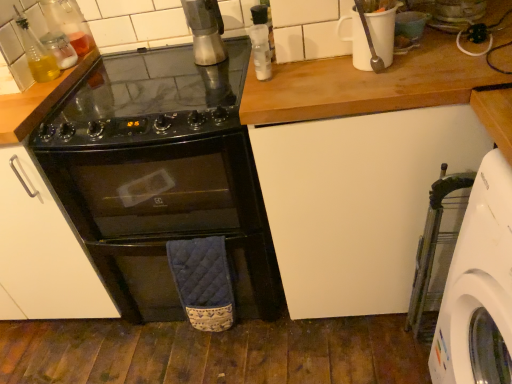
Question: Is translucent glass bottle at upper left, positioned as the 2th bottle in right-to-left order, directly adjacent to black glass gas stove at center?

Choices:
 (A) no
 (B) yes

Answer: (A)

Question: From a real-world perspective, is translucent glass bottle at upper left, positioned as the second bottle in left-to-right order, beneath black glass gas stove at center?

Choices:
 (A) yes
 (B) no

Answer: (B)

Question: Is translucent glass bottle at upper left, positioned as the 2th bottle in right-to-left order, outside black glass gas stove at center?

Choices:
 (A) no
 (B) yes

Answer: (B)

Question: Can black glass gas stove at center be found inside translucent glass bottle at upper left, positioned as the second bottle in left-to-right order?

Choices:
 (A) no
 (B) yes

Answer: (A)

Question: Is translucent glass bottle at upper left, positioned as the second bottle in left-to-right order, bigger than black glass gas stove at center?

Choices:
 (A) no
 (B) yes

Answer: (A)

Question: From the image's perspective, is black glass oven at center located above or below white plastic washing machine at lower right?

Choices:
 (A) above
 (B) below

Answer: (A)

Question: Would you say black glass oven at center is to the left or to the right of white plastic washing machine at lower right in the picture?

Choices:
 (A) left
 (B) right

Answer: (A)

Question: From their relative heights in the image, would you say black glass oven at center is taller or shorter than white plastic washing machine at lower right?

Choices:
 (A) short
 (B) tall

Answer: (B)

Question: Does point (87, 130) appear closer or farther from the camera than point (430, 233)?

Choices:
 (A) farther
 (B) closer

Answer: (B)

Question: Is white matte cabinet at center inside the boundaries of metallic silver grinder at upper center, or outside?

Choices:
 (A) inside
 (B) outside

Answer: (B)

Question: Is white matte cabinet at center to the left or to the right of metallic silver grinder at upper center in the image?

Choices:
 (A) left
 (B) right

Answer: (B)

Question: From a real-world perspective, is white matte cabinet at center above or below metallic silver grinder at upper center?

Choices:
 (A) below
 (B) above

Answer: (A)

Question: Considering the positions of white matte cabinet at center and metallic silver grinder at upper center in the image, is white matte cabinet at center bigger or smaller than metallic silver grinder at upper center?

Choices:
 (A) big
 (B) small

Answer: (A)

Question: From the image's perspective, relative to black glass gas stove at center, is metallic silver grinder at upper center above or below?

Choices:
 (A) above
 (B) below

Answer: (A)

Question: Based on their sizes in the image, would you say metallic silver grinder at upper center is bigger or smaller than black glass gas stove at center?

Choices:
 (A) small
 (B) big

Answer: (A)